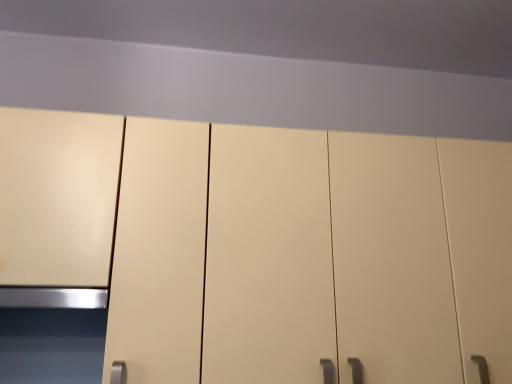
This screenshot has height=384, width=512. What are the coordinates of `matte cream cupboard at center` in the screenshot? It's located at (267, 246).

What is the approximate width of matte cream cupboard at center?

13.62 inches.

What do you see at coordinates (267, 246) in the screenshot?
I see `matte cream cupboard at center` at bounding box center [267, 246].

Find the location of a particular element. This screenshot has height=384, width=512. matte cream cupboard at center is located at coordinates (267, 246).